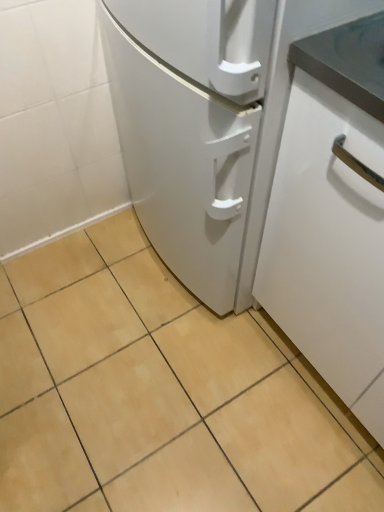
Question: From the image's perspective, would you say beige ceramic tile at center is positioned over white matte cabinet at right?

Choices:
 (A) yes
 (B) no

Answer: (B)

Question: Does beige ceramic tile at center contain white matte cabinet at right?

Choices:
 (A) yes
 (B) no

Answer: (B)

Question: From a real-world perspective, does beige ceramic tile at center stand above white matte cabinet at right?

Choices:
 (A) no
 (B) yes

Answer: (A)

Question: Is beige ceramic tile at center not near white matte cabinet at right?

Choices:
 (A) no
 (B) yes

Answer: (A)

Question: Is beige ceramic tile at center located outside white matte cabinet at right?

Choices:
 (A) yes
 (B) no

Answer: (A)

Question: Is beige ceramic tile at center with white matte cabinet at right?

Choices:
 (A) no
 (B) yes

Answer: (A)

Question: Is white matte cabinet at right to the right of beige ceramic tile at center from the viewer's perspective?

Choices:
 (A) yes
 (B) no

Answer: (A)

Question: Can you confirm if white matte cabinet at right is smaller than beige ceramic tile at center?

Choices:
 (A) no
 (B) yes

Answer: (A)

Question: From a real-world perspective, is white matte cabinet at right positioned over beige ceramic tile at center based on gravity?

Choices:
 (A) yes
 (B) no

Answer: (A)

Question: Can you confirm if white matte cabinet at right is wider than beige ceramic tile at center?

Choices:
 (A) no
 (B) yes

Answer: (A)

Question: From the image's perspective, is white matte cabinet at right on beige ceramic tile at center?

Choices:
 (A) no
 (B) yes

Answer: (B)

Question: Is white matte cabinet at right touching beige ceramic tile at center?

Choices:
 (A) no
 (B) yes

Answer: (A)

Question: Is white matte cabinet at right in front of or behind beige ceramic tile at center in the image?

Choices:
 (A) front
 (B) behind

Answer: (A)